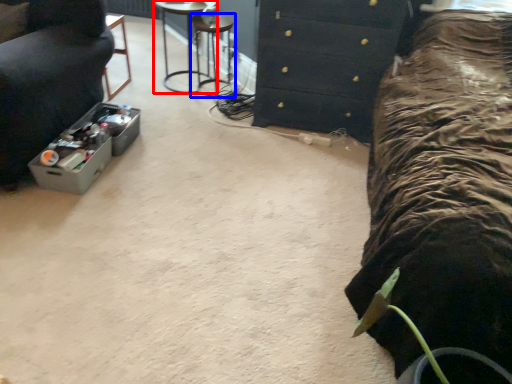
Question: Which object is closer to the camera taking this photo, furniture (highlighted by a red box) or bar stool (highlighted by a blue box)?

Choices:
 (A) furniture
 (B) bar stool

Answer: (A)